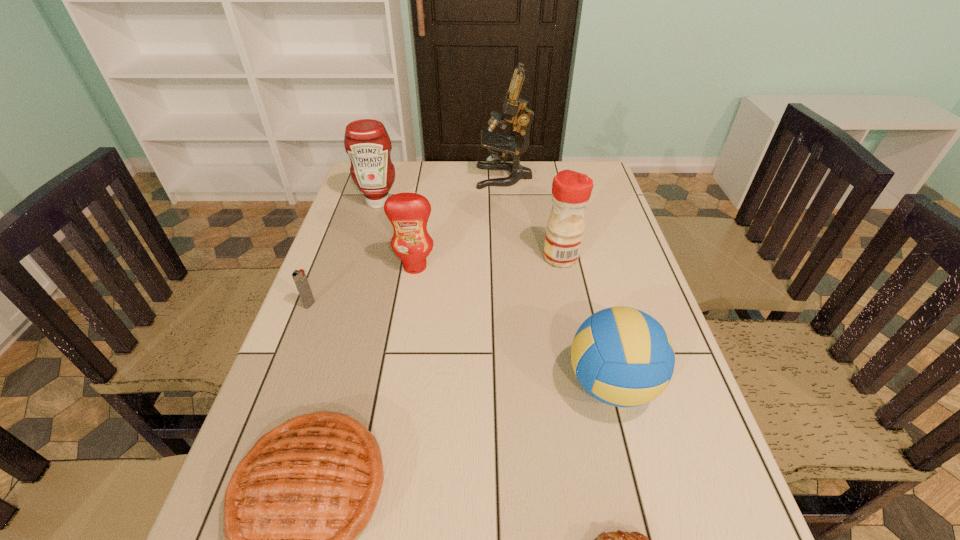
The height and width of the screenshot is (540, 960). What are the coordinates of `the tallest object` in the screenshot? It's located at (515, 111).

Where is `microscope`? microscope is located at coordinates (515, 111).

At what (x,y) coordinates should I click in order to perform the action: click on the farthest condiment. Please return your answer as a coordinate pair (x, y). The image size is (960, 540). Looking at the image, I should click on (366, 141).

The width and height of the screenshot is (960, 540). In order to click on the leftmost condiment in this screenshot , I will do `click(366, 141)`.

Where is `the rightmost condiment`? the rightmost condiment is located at coordinates (571, 190).

This screenshot has width=960, height=540. I want to click on the second condiment from right to left, so click(408, 213).

The width and height of the screenshot is (960, 540). Find the location of `volleyball`. volleyball is located at coordinates (623, 357).

Identify the location of igniter. This screenshot has height=540, width=960. (299, 277).

Identify the location of blank space located at the eyepieces of the tallest object. Image resolution: width=960 pixels, height=540 pixels. (420, 177).

Locate an element on the screen. The width and height of the screenshot is (960, 540). free space located 0.260m at the eyepieces of the tallest object is located at coordinates (403, 177).